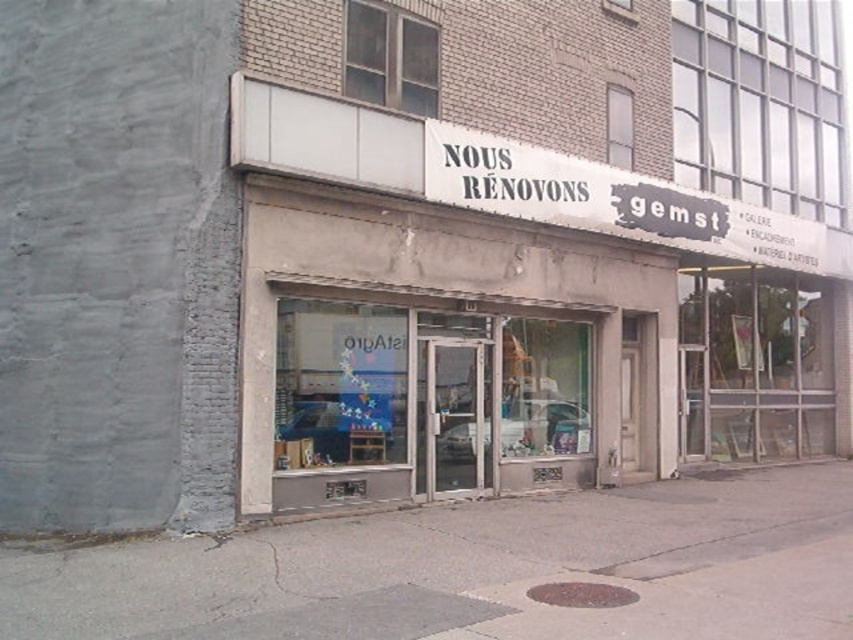
Question: Which object appears closest to the camera in this image?

Choices:
 (A) white paper sign at upper center
 (B) transparent glass shop window at center

Answer: (B)

Question: Which object is closer to the camera taking this photo?

Choices:
 (A) transparent glass shop window at center
 (B) white paper sign at upper center

Answer: (A)

Question: Does transparent glass shop window at center have a lesser width compared to white paper sign at upper center?

Choices:
 (A) yes
 (B) no

Answer: (A)

Question: Does transparent glass shop window at center lie in front of white paper sign at upper center?

Choices:
 (A) yes
 (B) no

Answer: (A)

Question: Which point is farther to the camera?

Choices:
 (A) transparent glass shop window at center
 (B) white paper sign at upper center

Answer: (B)

Question: Does transparent glass shop window at center have a larger size compared to white paper sign at upper center?

Choices:
 (A) no
 (B) yes

Answer: (A)